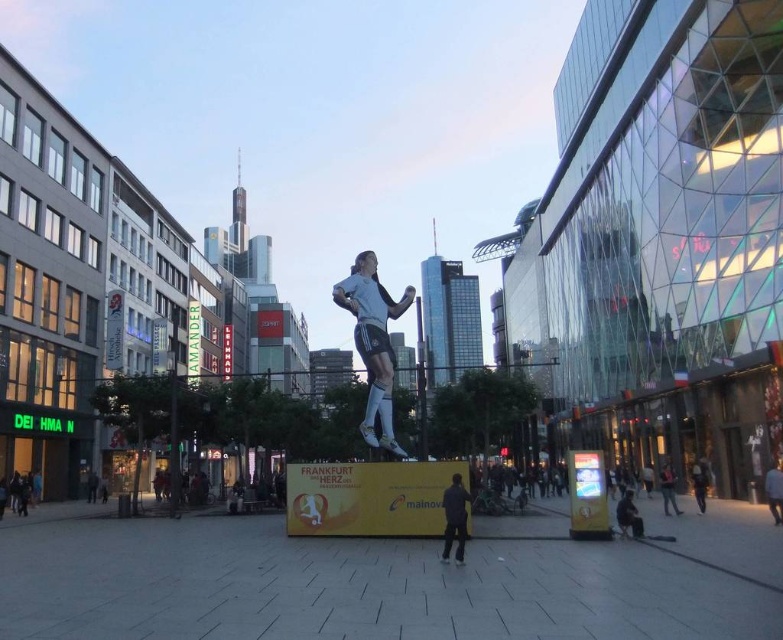
Question: Among these objects, which one is nearest to the camera?

Choices:
 (A) dark gray fabric jacket at lower center
 (B) white matte figure at center
 (C) white jersey at center
 (D) white matte soccer player at center

Answer: (A)

Question: Considering the relative positions of dark gray fabric jacket at lower center and dark gray fabric jacket at lower right in the image provided, where is dark gray fabric jacket at lower center located with respect to dark gray fabric jacket at lower right?

Choices:
 (A) right
 (B) left

Answer: (B)

Question: Does dark gray fabric jacket at lower right appear on the right side of green fabric jacket at center?

Choices:
 (A) yes
 (B) no

Answer: (B)

Question: Can you confirm if dark gray fabric jacket at lower right is positioned below green fabric jacket at center?

Choices:
 (A) yes
 (B) no

Answer: (B)

Question: Which object is the farthest from the dark gray fabric jacket at lower center?

Choices:
 (A) white matte soccer player at center
 (B) green fabric jacket at center

Answer: (B)

Question: Which object is farther from the camera taking this photo?

Choices:
 (A) dark gray fabric jacket at lower center
 (B) green fabric jacket at center

Answer: (B)